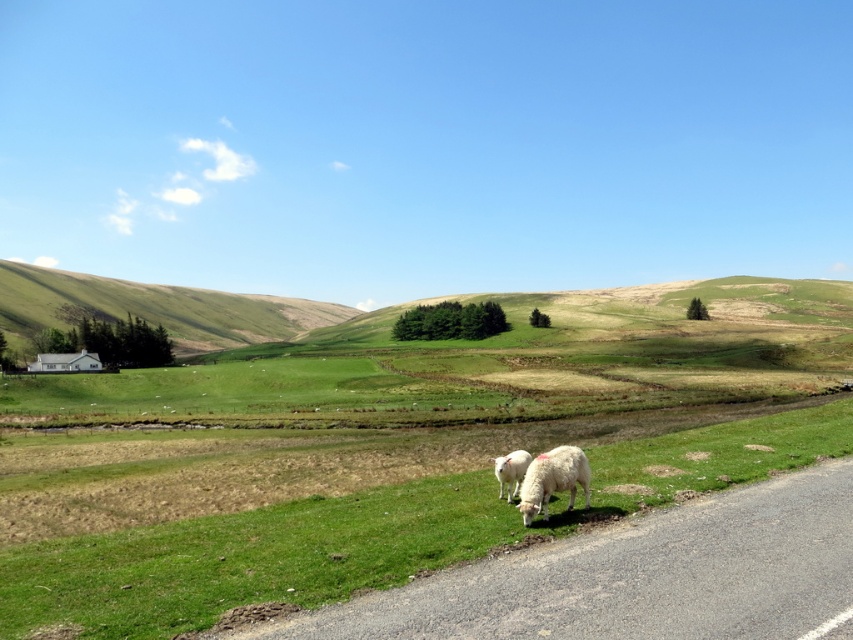
Question: Based on their relative distances, which object is nearer to the white woolly sheep at lower right?

Choices:
 (A) green grass at lower center
 (B) white woolly sheep at lower center
 (C) green grassy hillside at left

Answer: (B)

Question: Based on their relative distances, which object is nearer to the green grass at lower center?

Choices:
 (A) white woolly sheep at lower center
 (B) green grassy hillside at left

Answer: (A)

Question: Estimate the real-world distances between objects in this image. Which object is farther from the green grass at lower center?

Choices:
 (A) green grassy hillside at left
 (B) white woolly sheep at lower right
 (C) white woolly sheep at lower center

Answer: (A)

Question: Observing the image, what is the correct spatial positioning of green grass at lower center in reference to white woolly sheep at lower center?

Choices:
 (A) above
 (B) below

Answer: (B)

Question: Can you confirm if green grassy hillside at left is positioned below white woolly sheep at lower center?

Choices:
 (A) no
 (B) yes

Answer: (A)

Question: Can you confirm if green grassy hillside at left is smaller than white woolly sheep at lower center?

Choices:
 (A) no
 (B) yes

Answer: (A)